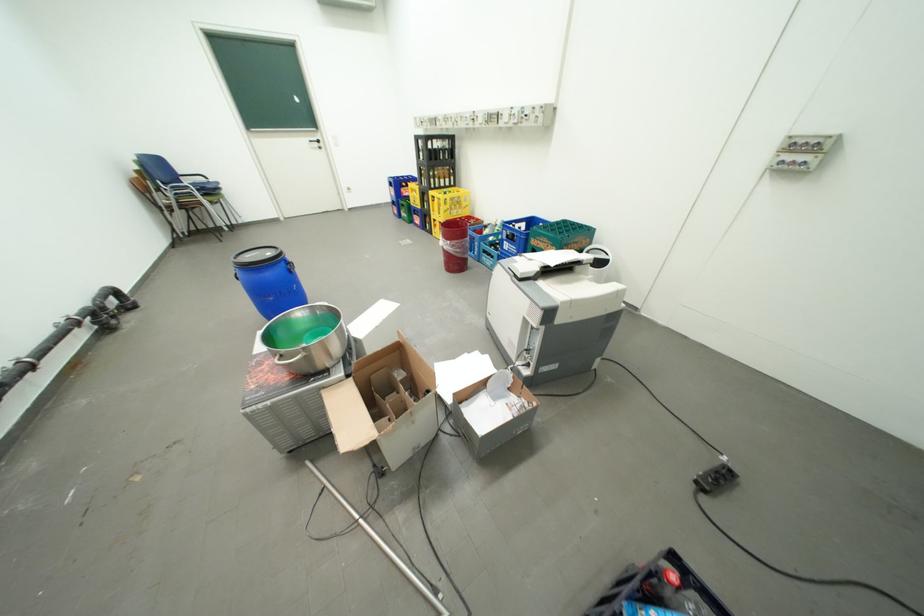
Which object does [517,235] point to?

It refers to a blue bottle crate.